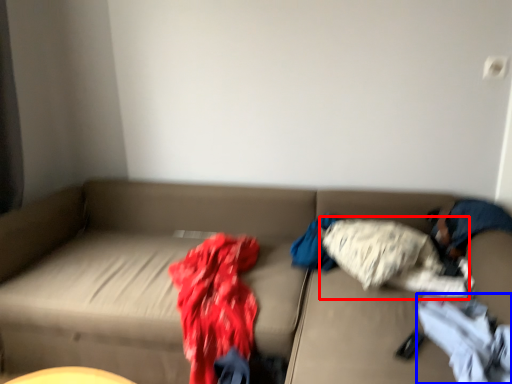
Question: Which object is further to the camera taking this photo, clothing (highlighted by a red box) or clothing (highlighted by a blue box)?

Choices:
 (A) clothing
 (B) clothing

Answer: (A)